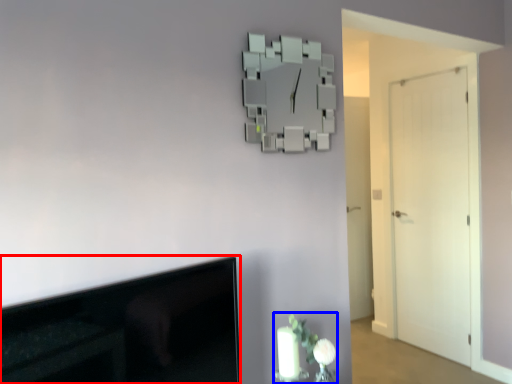
Question: Which object is closer to the camera taking this photo, television (highlighted by a red box) or floral arrangement (highlighted by a blue box)?

Choices:
 (A) television
 (B) floral arrangement

Answer: (A)